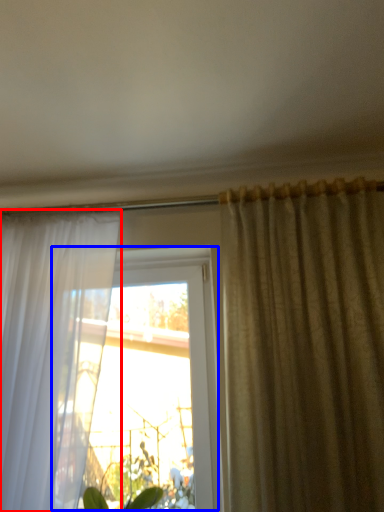
Question: Which point is closer to the camera, curtain (highlighted by a red box) or window (highlighted by a blue box)?

Choices:
 (A) curtain
 (B) window

Answer: (A)